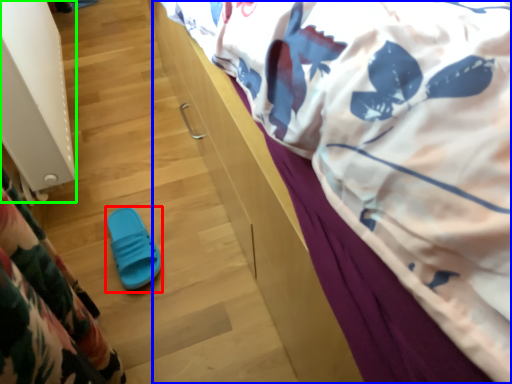
Question: Which object is positioned farthest from footwear (highlighted by a red box)? Select from bed (highlighted by a blue box) and radiator (highlighted by a green box).

Choices:
 (A) bed
 (B) radiator

Answer: (A)